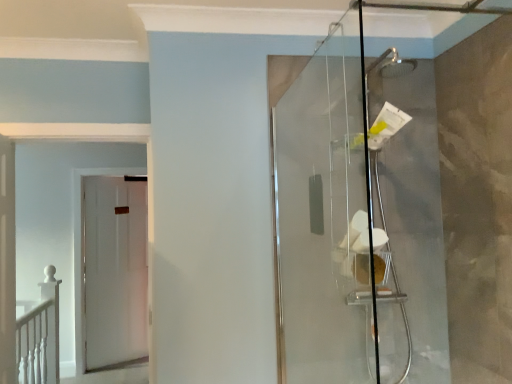
The height and width of the screenshot is (384, 512). What do you see at coordinates (7, 261) in the screenshot?
I see `white matte door at left, arranged as the first door when viewed from the front` at bounding box center [7, 261].

Describe the element at coordinates (39, 334) in the screenshot. Image resolution: width=512 pixels, height=384 pixels. I see `white matte railing at lower left` at that location.

The height and width of the screenshot is (384, 512). Find the location of `white matte door at left, the 2th door in the back-to-front sequence`. white matte door at left, the 2th door in the back-to-front sequence is located at coordinates (7, 261).

The image size is (512, 384). In order to click on glass door above the white matte door at left, arranged as the first door when viewed from the front (from the image's perspective) in this screenshot , I will do `click(334, 222)`.

From the image's perspective, which one is positioned lower, transparent glass shower door at right or white matte door at left, arranged as the first door when viewed from the front?

white matte door at left, arranged as the first door when viewed from the front.

From a real-world perspective, is transparent glass shower door at right physically above white matte door at left, the 2th door in the back-to-front sequence?

Yes, from a real-world perspective, transparent glass shower door at right is above white matte door at left, the 2th door in the back-to-front sequence.

Considering the positions of points (342, 346) and (14, 171), is point (342, 346) closer to camera compared to point (14, 171)?

That is True.

Is white matte door at left, arranged as the first door when viewed from the front, next to white matte door at left, the 2th door from the front, and touching it?

No, white matte door at left, arranged as the first door when viewed from the front, is not with white matte door at left, the 2th door from the front.

Looking at this image, which of these two, white matte door at left, the 2th door in the back-to-front sequence, or white matte door at left, the 2th door from the front, is bigger?

white matte door at left, the 2th door in the back-to-front sequence, is bigger.

Which is more to the left, white matte door at left, the 2th door in the back-to-front sequence, or white matte door at left, the 2th door from the front?

From the viewer's perspective, white matte door at left, the 2th door from the front, appears more on the left side.

Which of these two, white matte door at left, arranged as the first door when viewed from the front, or white matte door at left, which appears as the 1th door when viewed from the back, is wider?

white matte door at left, arranged as the first door when viewed from the front, is wider.

You are a GUI agent. You are given a task and a screenshot of the screen. Output one action in this format:
    pyautogui.click(x=<x>, y=<y>)
    Task: Click on the glass door above the white matte door at left, the 2th door from the front (from a real-world perspective)
    The image size is (512, 384).
    Given the screenshot: What is the action you would take?
    pyautogui.click(x=334, y=222)

From the picture: From a real-world perspective, is transparent glass shower door at right physically located above or below white matte door at left, the 2th door from the front?

In terms of real-world spatial position, transparent glass shower door at right is above white matte door at left, the 2th door from the front.

From the image's perspective, is transparent glass shower door at right positioned above or below white matte door at left, the 2th door from the front?

Based on their image positions, transparent glass shower door at right is located above white matte door at left, the 2th door from the front.

Looking at this image, which is more to the left, transparent glass shower door at right or white matte door at left, which appears as the 1th door when viewed from the back?

From the viewer's perspective, white matte door at left, which appears as the 1th door when viewed from the back, appears more on the left side.

Does white matte railing at lower left have a smaller size compared to white matte door at left, which appears as the 1th door when viewed from the back?

No, white matte railing at lower left is not smaller than white matte door at left, which appears as the 1th door when viewed from the back.

Are white matte railing at lower left and white matte door at left, the 2th door from the front, located far from each other?

Indeed, white matte railing at lower left is not near white matte door at left, the 2th door from the front.

Can you confirm if white matte railing at lower left is taller than white matte door at left, which appears as the 1th door when viewed from the back?

Incorrect, the height of white matte railing at lower left is not larger of that of white matte door at left, which appears as the 1th door when viewed from the back.

Could you measure the distance between white matte railing at lower left and white matte door at left, which appears as the 1th door when viewed from the back?

The distance of white matte railing at lower left from white matte door at left, which appears as the 1th door when viewed from the back, is 3.58 feet.

How many degrees apart are the facing directions of white matte door at left, which appears as the 1th door when viewed from the back, and transparent glass shower door at right?

The angular difference between white matte door at left, which appears as the 1th door when viewed from the back, and transparent glass shower door at right is 63.9 degrees.

In the scene shown: Is white matte door at left, which appears as the 1th door when viewed from the back, positioned far away from transparent glass shower door at right?

That's right, there is a large distance between white matte door at left, which appears as the 1th door when viewed from the back, and transparent glass shower door at right.

Can you confirm if white matte door at left, the 2th door from the front, is taller than transparent glass shower door at right?

Indeed, white matte door at left, the 2th door from the front, has a greater height compared to transparent glass shower door at right.

From the image's perspective, is white matte door at left, the 2th door from the front, over transparent glass shower door at right?

No, from the image's perspective, white matte door at left, the 2th door from the front, is not on top of transparent glass shower door at right.

Considering the positions of objects white matte door at left, which appears as the 1th door when viewed from the back, and white matte door at left, arranged as the first door when viewed from the front, in the image provided, who is more to the left, white matte door at left, which appears as the 1th door when viewed from the back, or white matte door at left, arranged as the first door when viewed from the front,?

white matte door at left, which appears as the 1th door when viewed from the back.

Looking at this image, is the position of white matte door at left, the 2th door from the front, more distant than that of white matte door at left, the 2th door in the back-to-front sequence?

Yes.

Considering the sizes of white matte door at left, which appears as the 1th door when viewed from the back, and white matte door at left, arranged as the first door when viewed from the front, in the image, is white matte door at left, which appears as the 1th door when viewed from the back, wider or thinner than white matte door at left, arranged as the first door when viewed from the front,?

white matte door at left, which appears as the 1th door when viewed from the back, is thinner than white matte door at left, arranged as the first door when viewed from the front.

From a real-world perspective, is white matte door at left, the 2th door from the front, physically below white matte railing at lower left?

No, from a real-world perspective, white matte door at left, the 2th door from the front, is not below white matte railing at lower left.

Which object is further away from the camera, white matte door at left, the 2th door from the front, or white matte railing at lower left?

white matte door at left, the 2th door from the front, is more distant.

Looking at their sizes, would you say white matte door at left, the 2th door from the front, is wider or thinner than white matte railing at lower left?

Clearly, white matte door at left, the 2th door from the front, has less width compared to white matte railing at lower left.

Is white matte door at left, the 2th door from the front, next to white matte railing at lower left?

No, white matte door at left, the 2th door from the front, is not making contact with white matte railing at lower left.

Image resolution: width=512 pixels, height=384 pixels. I want to click on the 1st door below when counting from the transparent glass shower door at right (from the image's perspective), so click(7, 261).

Find the location of `door on the left of the white matte door at left, arranged as the first door when viewed from the front`. door on the left of the white matte door at left, arranged as the first door when viewed from the front is located at coordinates (115, 271).

Consider the image. Based on their spatial positions, is white matte door at left, the 2th door from the front, or white matte railing at lower left further from white matte door at left, arranged as the first door when viewed from the front?

The object further to white matte door at left, arranged as the first door when viewed from the front, is white matte door at left, the 2th door from the front.

Looking at this image, considering their positions, is white matte railing at lower left positioned further to transparent glass shower door at right than white matte door at left, which appears as the 1th door when viewed from the back?

Among the two, white matte door at left, which appears as the 1th door when viewed from the back, is located further to transparent glass shower door at right.

From the image, which object appears to be nearer to white matte railing at lower left, white matte door at left, the 2th door from the front, or transparent glass shower door at right?

white matte door at left, the 2th door from the front, lies closer to white matte railing at lower left than the other object.

From the image, which object appears to be farther from transparent glass shower door at right, white matte door at left, arranged as the first door when viewed from the front, or white matte railing at lower left?

Among the two, white matte railing at lower left is located further to transparent glass shower door at right.

Estimate the real-world distances between objects in this image. Which object is closer to transparent glass shower door at right, white matte railing at lower left or white matte door at left, arranged as the first door when viewed from the front?

The object closer to transparent glass shower door at right is white matte door at left, arranged as the first door when viewed from the front.

Based on their spatial positions, is white matte railing at lower left or white matte door at left, arranged as the first door when viewed from the front, further from white matte door at left, the 2th door from the front?

white matte door at left, arranged as the first door when viewed from the front, lies further to white matte door at left, the 2th door from the front, than the other object.

When comparing their distances from white matte door at left, arranged as the first door when viewed from the front, does white matte door at left, the 2th door from the front, or transparent glass shower door at right seem further?

white matte door at left, the 2th door from the front, is positioned further to the anchor white matte door at left, arranged as the first door when viewed from the front.

Looking at the image, which one is located closer to white matte railing at lower left, transparent glass shower door at right or white matte door at left, arranged as the first door when viewed from the front?

The object closer to white matte railing at lower left is white matte door at left, arranged as the first door when viewed from the front.

At what (x,y) coordinates should I click in order to perform the action: click on rail positioned between transparent glass shower door at right and white matte door at left, the 2th door from the front, from near to far. Please return your answer as a coordinate pair (x, y). The height and width of the screenshot is (384, 512). Looking at the image, I should click on (39, 334).

I want to click on rail between white matte door at left, the 2th door in the back-to-front sequence, and white matte door at left, which appears as the 1th door when viewed from the back, in the front-back direction, so click(39, 334).

Where is `door between transparent glass shower door at right and white matte door at left, the 2th door from the front, in the front-back direction`? door between transparent glass shower door at right and white matte door at left, the 2th door from the front, in the front-back direction is located at coordinates (7, 261).